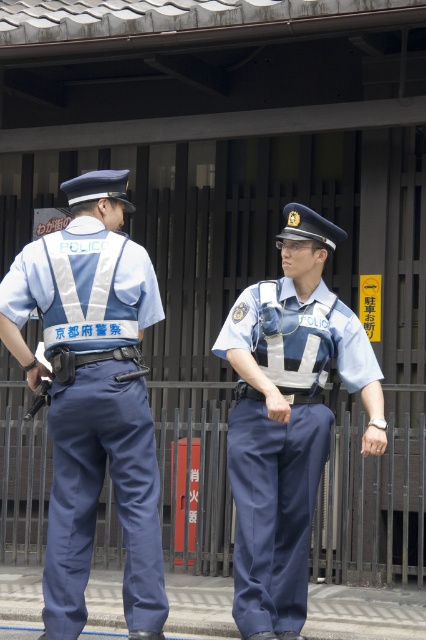
Question: Which point is farther to the camera?

Choices:
 (A) (376, 380)
 (B) (83, 602)
 (C) (141, 572)

Answer: (A)

Question: Does blue fabric uniform at left appear over navy blue fabric uniform at center?

Choices:
 (A) yes
 (B) no

Answer: (A)

Question: Which object appears closest to the camera in this image?

Choices:
 (A) navy blue fabric uniform at center
 (B) blue fabric uniform at left
 (C) blue uniform at center

Answer: (B)

Question: Is blue uniform at center further to camera compared to blue fabric uniform at left?

Choices:
 (A) yes
 (B) no

Answer: (A)

Question: Does blue fabric uniform at left appear on the right side of navy blue fabric uniform at center?

Choices:
 (A) yes
 (B) no

Answer: (B)

Question: Which object is the closest to the blue uniform at center?

Choices:
 (A) navy blue fabric uniform at center
 (B) blue fabric uniform at left

Answer: (A)